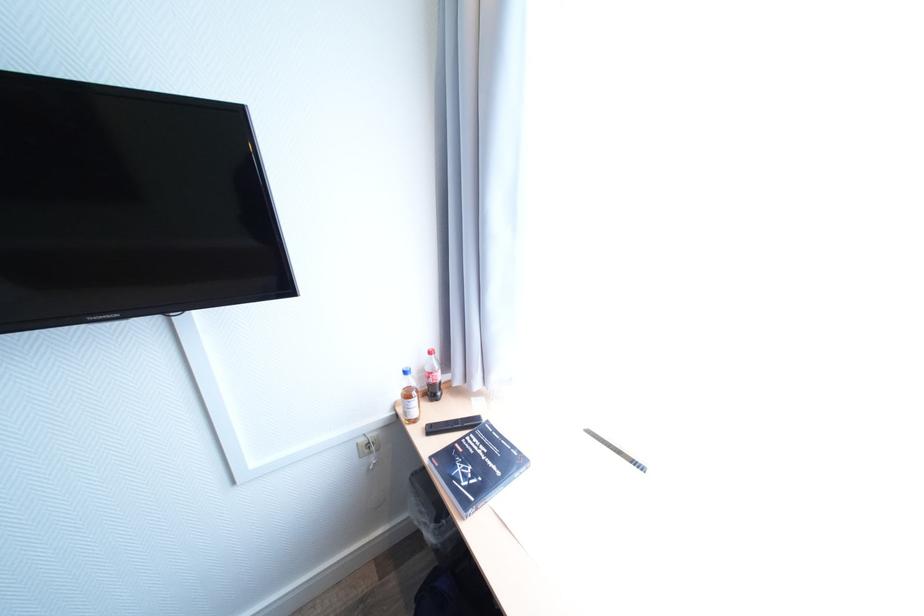
Describe the element at coordinates (408, 397) in the screenshot. I see `the blue bottle cap` at that location.